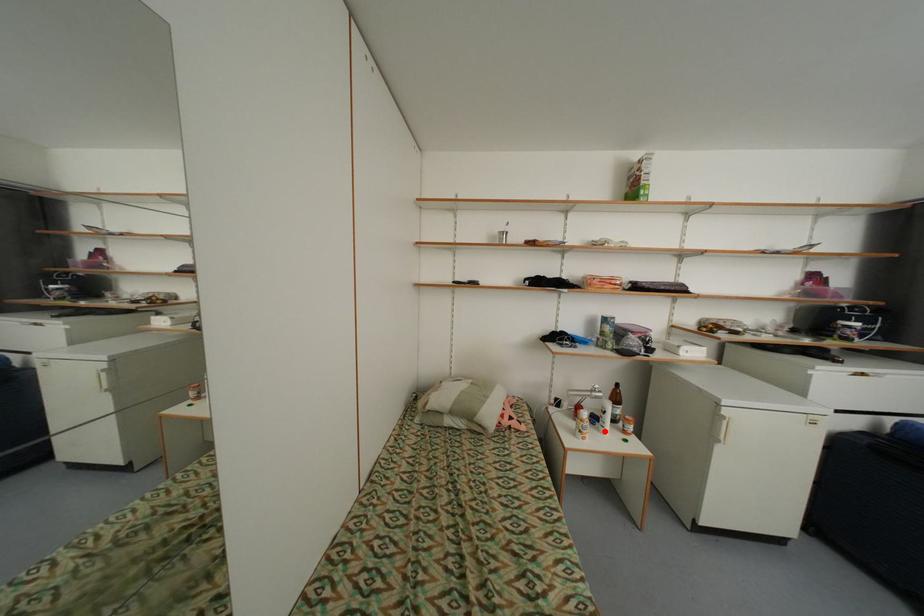
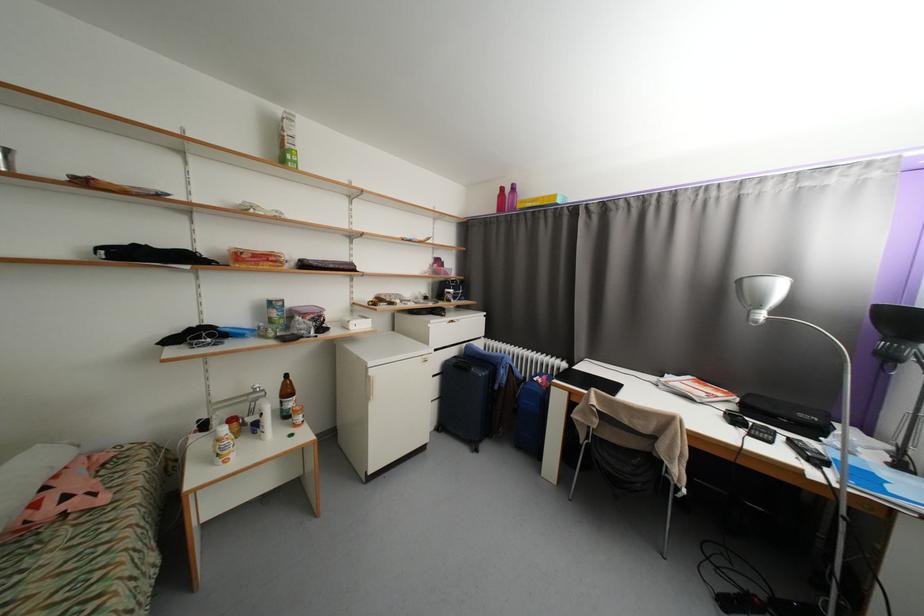
Question: I am providing you with two images of the same scene from different viewpoints. Image1 has a red point marked. In image2, the corresponding 3D location appears at what relative position? Reply with the corresponding letter.

Choices:
 (A) Closer
 (B) Farther

Answer: (A)